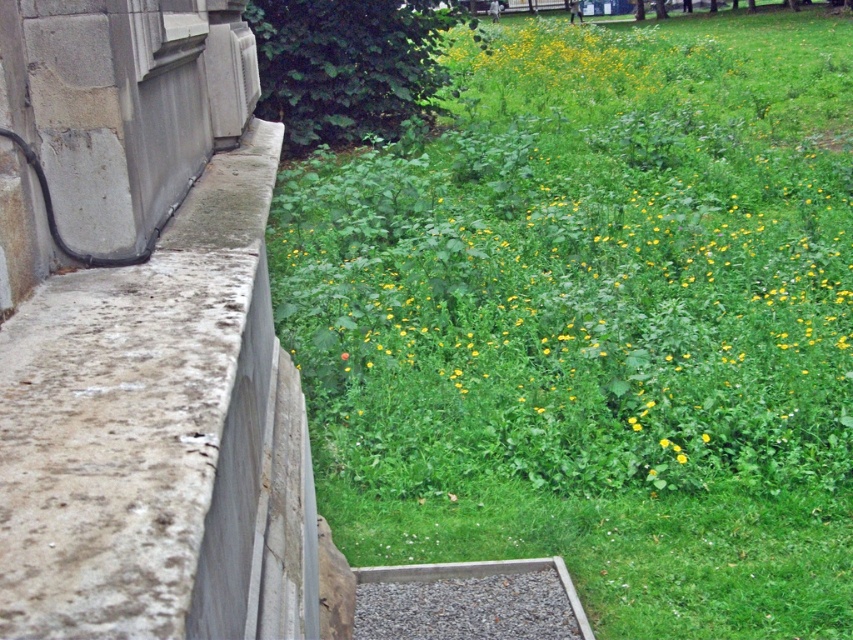
Find the location of a particular element. green leafy grass at upper right is located at coordinates (596, 321).

Which of these two, green leafy grass at upper right or gray gravel at bottom, stands shorter?

Standing shorter between the two is gray gravel at bottom.

Does point (825, 600) come closer to viewer compared to point (553, 634)?

No, it is behind (553, 634).

Where is `green leafy grass at upper right`? This screenshot has height=640, width=853. green leafy grass at upper right is located at coordinates (596, 321).

Looking at this image, does gray gravel at bottom appear on the left side of yellow matte flower at center?

Yes, gray gravel at bottom is to the left of yellow matte flower at center.

Where is `gray gravel at bottom`? This screenshot has width=853, height=640. gray gravel at bottom is located at coordinates (468, 602).

Who is positioned more to the right, concrete ledge at left or yellow matte flower at center?

yellow matte flower at center

Between point (258, 580) and point (679, 461), which one is positioned behind?

The point (679, 461) is behind.

Locate an element on the screen. Image resolution: width=853 pixels, height=640 pixels. concrete ledge at left is located at coordinates (154, 435).